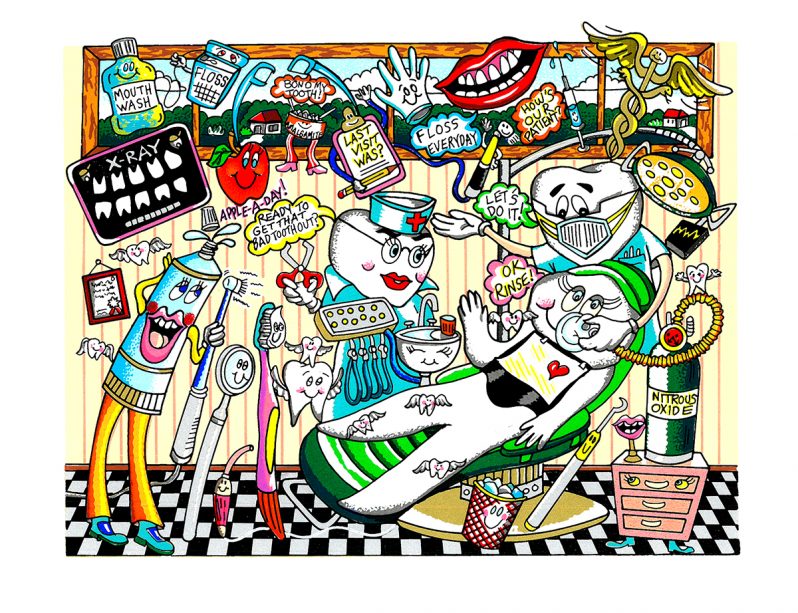
Locate an element on the screen. chair is located at coordinates (338, 466).